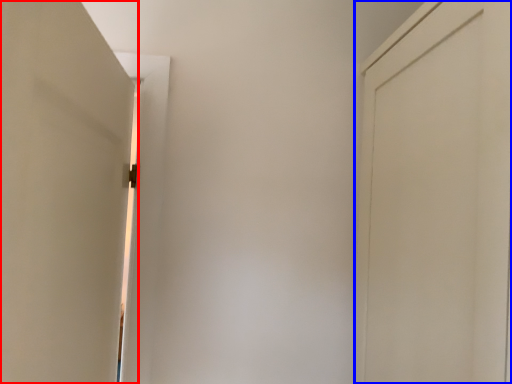
Question: Which object appears closest to the camera in this image, door (highlighted by a red box) or door (highlighted by a blue box)?

Choices:
 (A) door
 (B) door

Answer: (A)